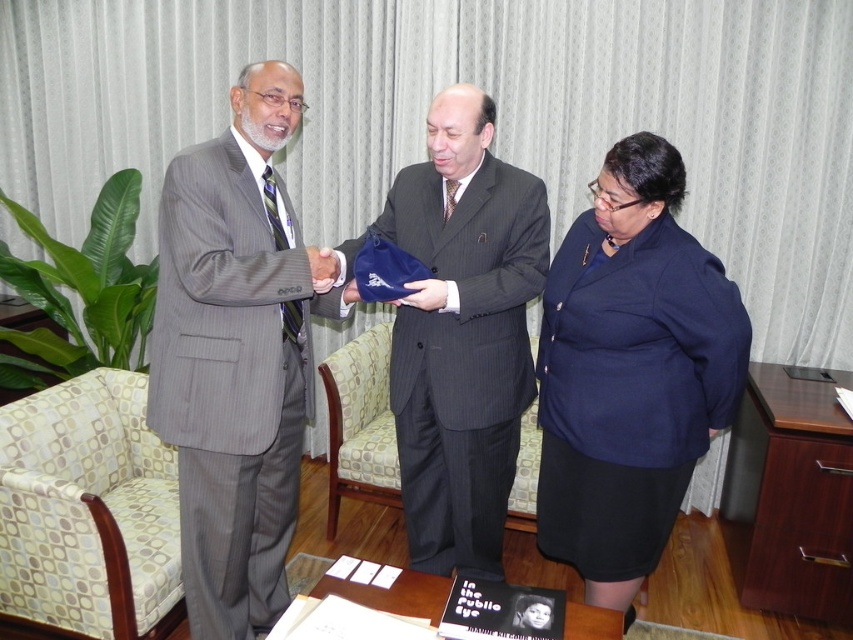
Where is `gray pinstripe suit at left`? Image resolution: width=853 pixels, height=640 pixels. gray pinstripe suit at left is located at coordinates [236, 355].

What are the coordinates of `gray pinstripe suit at left` in the screenshot? It's located at (236, 355).

Is navy blue wool skirt at lower right smaller than pinstriped suit at center?

Yes, navy blue wool skirt at lower right is smaller than pinstriped suit at center.

Can you confirm if navy blue wool skirt at lower right is bigger than pinstriped suit at center?

Incorrect, navy blue wool skirt at lower right is not larger than pinstriped suit at center.

Between point (589, 323) and point (518, 444), which one is positioned in front?

Point (589, 323) is more forward.

Find the location of a particular element. navy blue wool skirt at lower right is located at coordinates (630, 371).

Which is below, matte black suit at center or gray pinstripe armchair at center?

gray pinstripe armchair at center is lower down.

Identify the location of matte black suit at center. This screenshot has height=640, width=853. (241, 358).

Which is behind, point (219, 480) or point (384, 385)?

Positioned behind is point (384, 385).

Where is `matte black suit at center`? matte black suit at center is located at coordinates (241, 358).